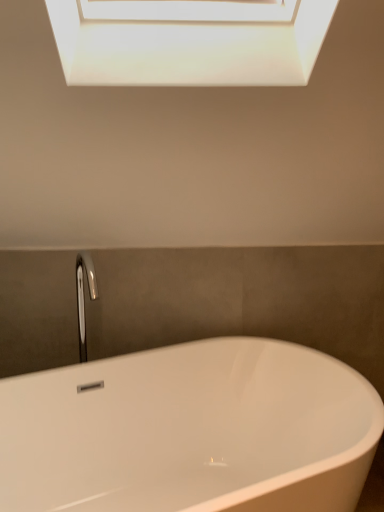
The width and height of the screenshot is (384, 512). What do you see at coordinates (242, 300) in the screenshot?
I see `white glossy bathtub at lower center` at bounding box center [242, 300].

You are a GUI agent. You are given a task and a screenshot of the screen. Output one action in this format:
    pyautogui.click(x=<x>, y=<y>)
    Task: Click on the white glossy bathtub at lower center
    The width and height of the screenshot is (384, 512).
    Given the screenshot: What is the action you would take?
    pyautogui.click(x=242, y=300)

Identify the location of white glossy bathtub at lower center. (242, 300).